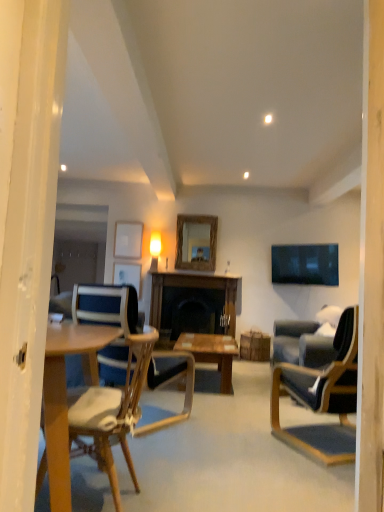
Question: Considering the positions of matte wooden picture frame at upper center, arranged as the 1th picture frame when ordered from the bottom, and rustic wood mirror at center in the image, is matte wooden picture frame at upper center, arranged as the 1th picture frame when ordered from the bottom, wider or thinner than rustic wood mirror at center?

Choices:
 (A) thin
 (B) wide

Answer: (A)

Question: From their relative heights in the image, would you say matte wooden picture frame at upper center, arranged as the 1th picture frame when ordered from the bottom, is taller or shorter than rustic wood mirror at center?

Choices:
 (A) tall
 (B) short

Answer: (B)

Question: Estimate the real-world distances between objects in this image. Which object is farther from the matte white picture frame at upper center, which ranks as the second picture frame in bottom-to-top order?

Choices:
 (A) wooden table at center
 (B) dark gray fabric chair at right, placed as the 2th chair when sorted from left to right
 (C) rustic wood mirror at center
 (D) wooden/matte coffee table at center
 (E) wooden chair at center, which ranks as the first chair in left-to-right order

Answer: (B)

Question: Which is nearer to the wooden chair at center, which ranks as the first chair in left-to-right order?

Choices:
 (A) wooden table at center
 (B) dark gray fabric chair at right, acting as the first chair starting from the right
 (C) matte white picture frame at upper center, which ranks as the second picture frame in bottom-to-top order
 (D) wooden/matte coffee table at center
 (E) wooden desk at left

Answer: (D)